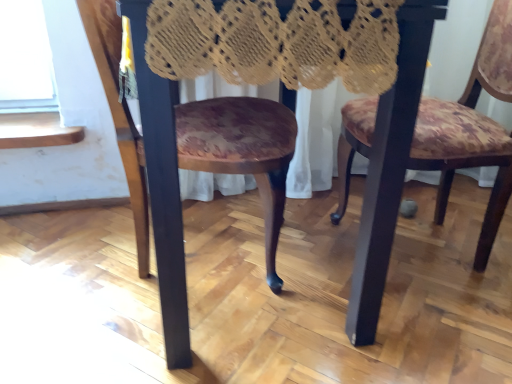
Find the location of `vacant area that is in front of floral fabric chair at center, marked as the second chair in a left-to-right arrangement`. vacant area that is in front of floral fabric chair at center, marked as the second chair in a left-to-right arrangement is located at coordinates (437, 325).